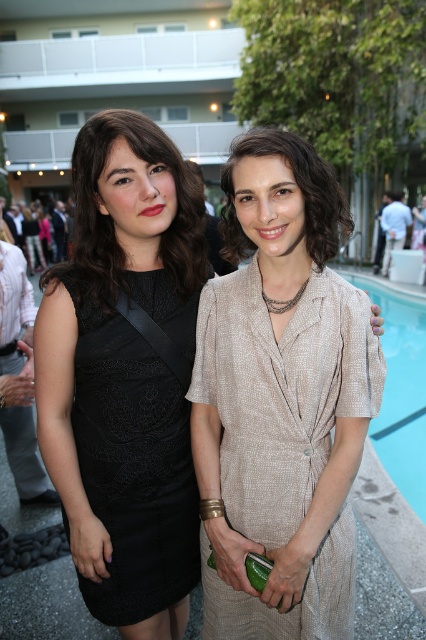
Question: Is blue smooth water at lower right positioned at the back of matte beige dress at center?

Choices:
 (A) no
 (B) yes

Answer: (B)

Question: Does blue smooth water at lower right lie behind matte beige dress at center?

Choices:
 (A) yes
 (B) no

Answer: (A)

Question: Considering the relative positions of beige textured dress at center and blue smooth water at lower right in the image provided, where is beige textured dress at center located with respect to blue smooth water at lower right?

Choices:
 (A) above
 (B) below

Answer: (B)

Question: Which object appears farthest from the camera in this image?

Choices:
 (A) beige textured dress at center
 (B) matte beige dress at center
 (C) black lace dress at left
 (D) blue smooth water at lower right

Answer: (D)

Question: Which point appears closest to the camera in this image?

Choices:
 (A) (336, 205)
 (B) (198, 380)
 (C) (391, 456)
 (D) (120, 493)

Answer: (A)

Question: Which object is positioned farthest from the blue smooth water at lower right?

Choices:
 (A) black lace dress at left
 (B) matte beige dress at center
 (C) beige textured dress at center

Answer: (B)